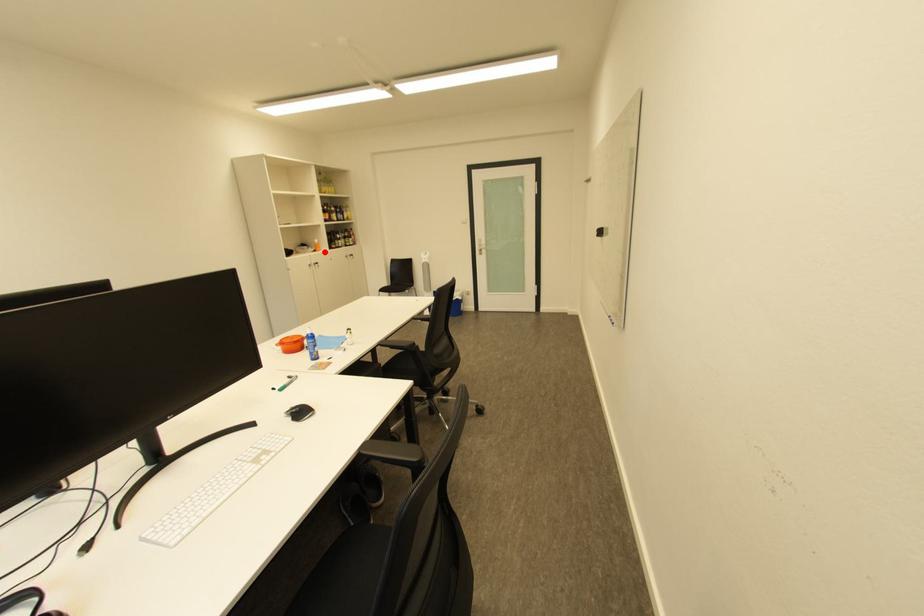
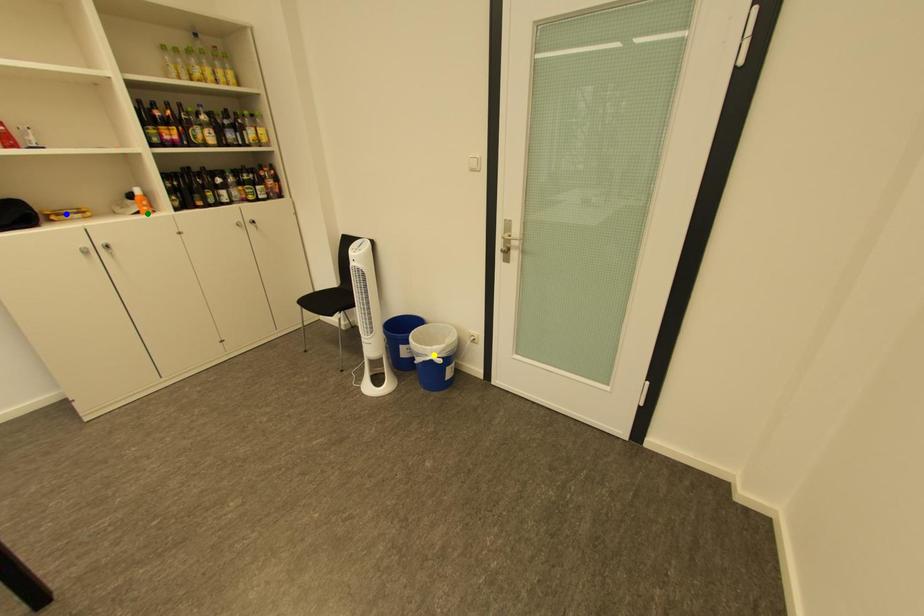
Question: I am providing you with two images of the same scene from different viewpoints. A red point is marked on the first image. You are given multiple points on the second image. Which mark in image 2 goes with the point in image 1?

Choices:
 (A) green point
 (B) blue point
 (C) yellow point

Answer: (A)